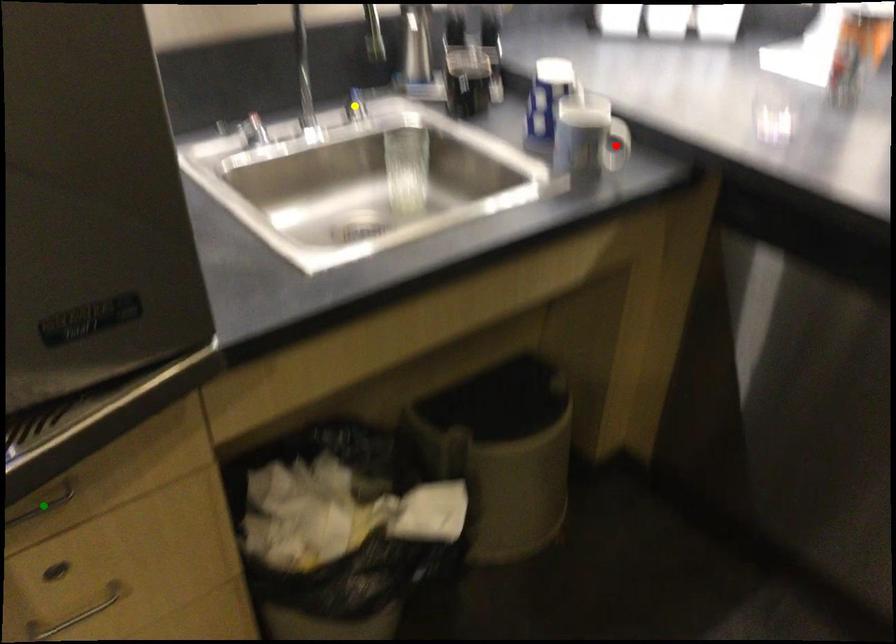
Order these from nearest to farthest:
- yellow point
- green point
- red point

green point < red point < yellow point